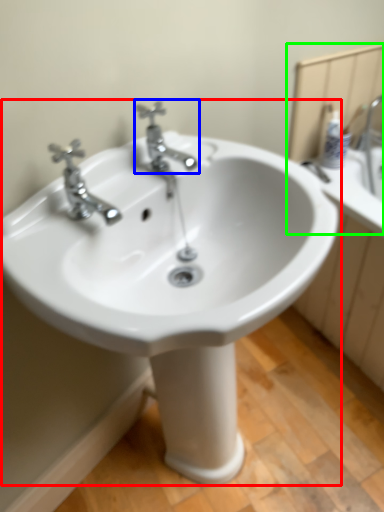
Question: Based on their relative distances, which object is nearer to sink (highlighted by a red box)? Choose from tap (highlighted by a blue box) and mirror (highlighted by a green box).

Choices:
 (A) tap
 (B) mirror

Answer: (A)